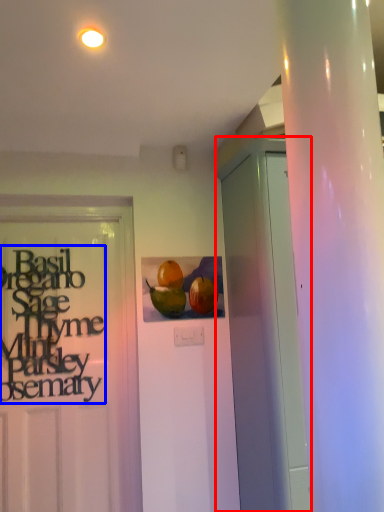
Question: Among these objects, which one is farthest to the camera, garage door (highlighted by a red box) or lettering (highlighted by a blue box)?

Choices:
 (A) garage door
 (B) lettering

Answer: (B)